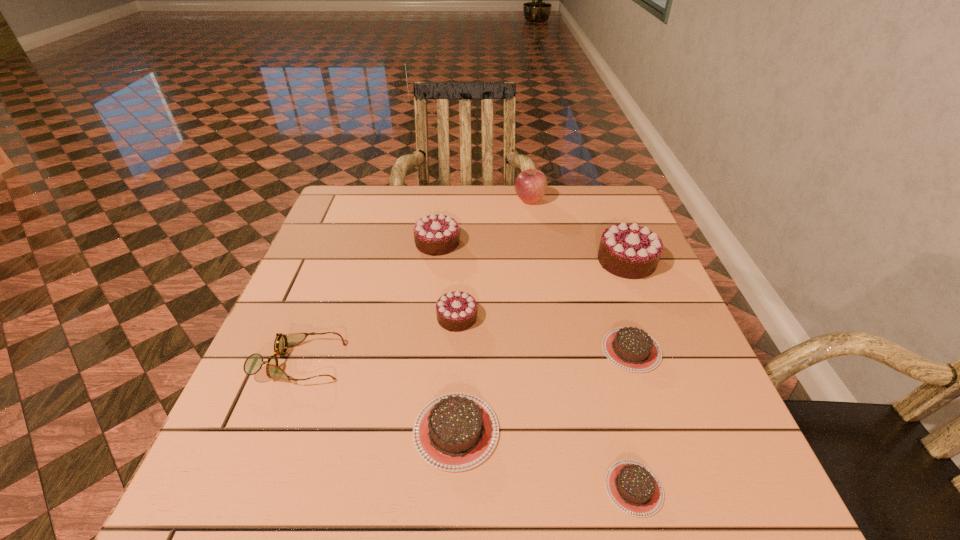
Locate an element on the screen. This screenshot has width=960, height=540. vacant space situated on the front-facing side of the fourth shortest object is located at coordinates (417, 362).

Locate an element on the screen. free space located 0.130m on the right of the biggest brown chocolate cake is located at coordinates 573,431.

Where is `vacant region located 0.050m on the right of the seventh tallest object`? The image size is (960, 540). vacant region located 0.050m on the right of the seventh tallest object is located at coordinates (684, 350).

Where is `vacant space located on the left of the shortest object`? This screenshot has width=960, height=540. vacant space located on the left of the shortest object is located at coordinates (567, 488).

At what (x,y) coordinates should I click in order to perform the action: click on object at the far edge. Please return your answer as a coordinate pair (x, y). The height and width of the screenshot is (540, 960). Looking at the image, I should click on (530, 185).

Locate an element on the screen. This screenshot has height=540, width=960. object located in the left edge section of the desktop is located at coordinates (253, 363).

This screenshot has width=960, height=540. I want to click on object present at the near right corner, so click(634, 488).

Where is `free region at the far edge`? Image resolution: width=960 pixels, height=540 pixels. free region at the far edge is located at coordinates pos(455,198).

At what (x,y) coordinates should I click in order to perform the action: click on vacant space at the near edge of the desktop. Please return your answer as a coordinate pair (x, y). This screenshot has height=540, width=960. Looking at the image, I should click on (351, 492).

Where is `vacant space at the left edge of the desktop`? vacant space at the left edge of the desktop is located at coordinates (249, 421).